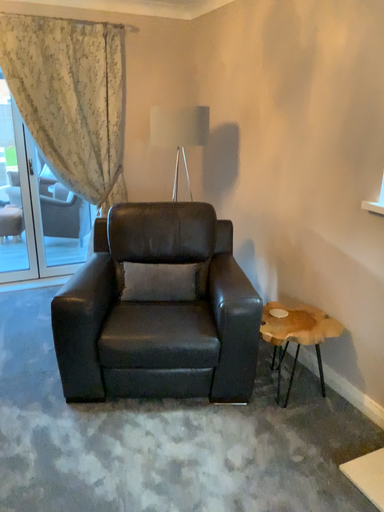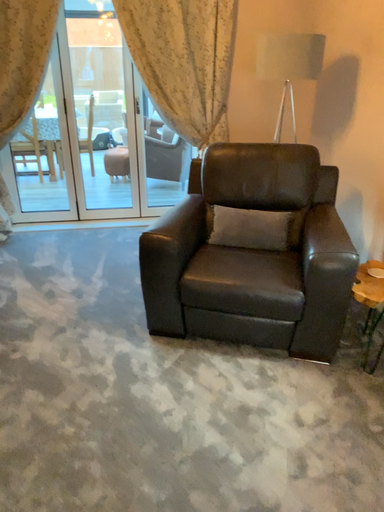
Question: Which way did the camera rotate in the video?

Choices:
 (A) rotated left
 (B) rotated right

Answer: (A)